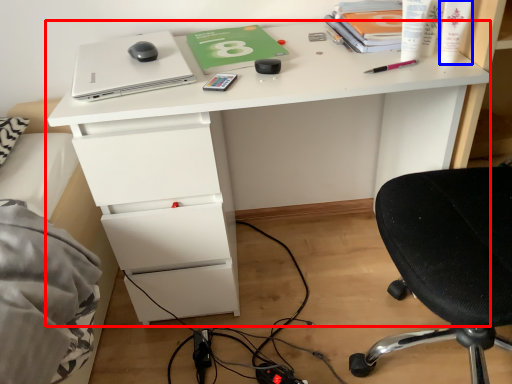
Question: Which of the following is the closest to the observer, desk (highlighted by a red box) or toiletry (highlighted by a blue box)?

Choices:
 (A) desk
 (B) toiletry

Answer: (B)